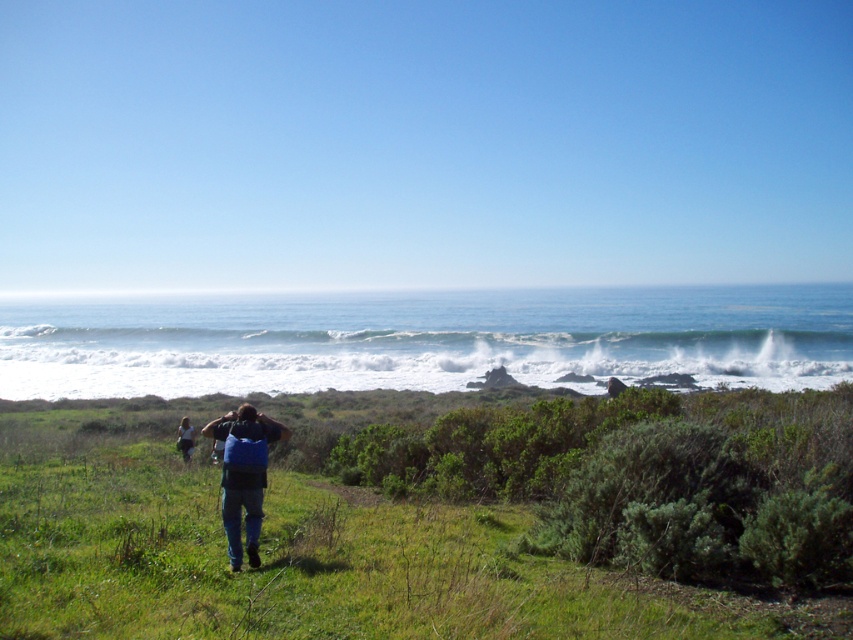
In the scene shown: Who is positioned more to the right, green grassy at center or blue fabric backpack at lower center?

From the viewer's perspective, blue fabric backpack at lower center appears more on the right side.

This screenshot has width=853, height=640. What are the coordinates of `green grassy at center` in the screenshot? It's located at (428, 518).

Does blue fabric backpack at center appear on the left side of blue fabric backpack at lower center?

No, blue fabric backpack at center is not to the left of blue fabric backpack at lower center.

Can you confirm if blue fabric backpack at center is shorter than blue fabric backpack at lower center?

No, blue fabric backpack at center is not shorter than blue fabric backpack at lower center.

Image resolution: width=853 pixels, height=640 pixels. What do you see at coordinates (242, 474) in the screenshot?
I see `blue fabric backpack at center` at bounding box center [242, 474].

Where is `blue fabric backpack at center`? blue fabric backpack at center is located at coordinates (242, 474).

Who is more distant from viewer, (190,403) or (242,472)?

Positioned behind is point (190,403).

Is point (651, 465) positioned in front of point (213, 436)?

No, it is not.

Is point (99, 598) positioned behind point (230, 545)?

That is False.

I want to click on green grassy at center, so click(x=428, y=518).